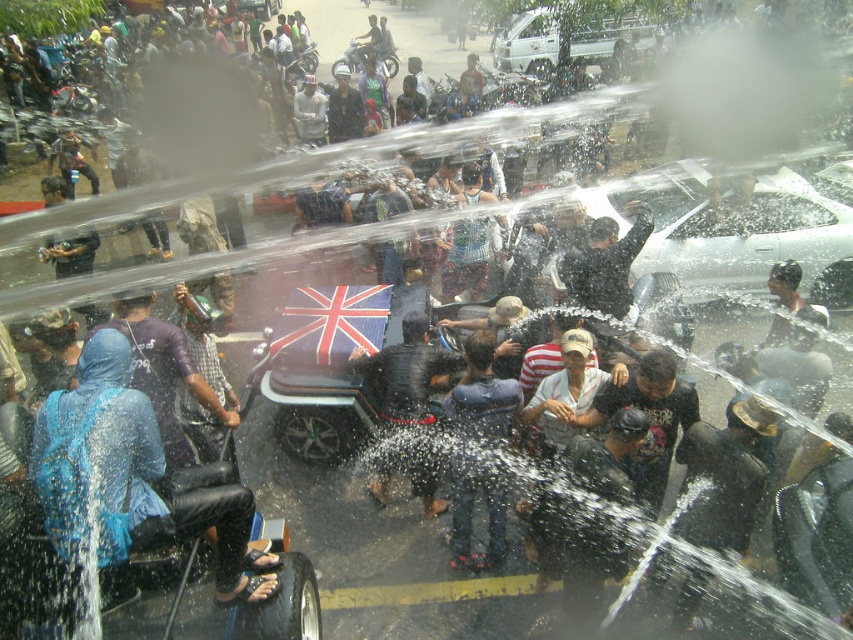
In the scene shown: Which of these two, blue fabric umbrella at left or dark blue jeans at center, stands shorter?

With less height is blue fabric umbrella at left.

Is blue fabric umbrella at left smaller than dark blue jeans at center?

No.

Is point (120, 472) positioned after point (509, 428)?

That is False.

What are the coordinates of `blue fabric umbrella at left` in the screenshot? It's located at (132, 477).

Can you confirm if dark blue jeans at center is shorter than dark blue fabric umbrella at center?

In fact, dark blue jeans at center may be taller than dark blue fabric umbrella at center.

Is dark blue jeans at center bigger than dark blue fabric umbrella at center?

Yes, dark blue jeans at center is bigger than dark blue fabric umbrella at center.

Who is more distant from viewer, (494, 557) or (392, 419)?

Point (392, 419)

Identify the location of dark blue jeans at center. This screenshot has width=853, height=640. (483, 445).

Is point (119, 552) positioned after point (425, 348)?

That is False.

How much distance is there between blue fabric umbrella at left and dark blue fabric umbrella at center?

blue fabric umbrella at left is 2.05 meters from dark blue fabric umbrella at center.

Who is more distant from viewer, (90, 458) or (427, 410)?

Positioned behind is point (427, 410).

Locate an element on the screen. The width and height of the screenshot is (853, 640). blue fabric umbrella at left is located at coordinates (132, 477).